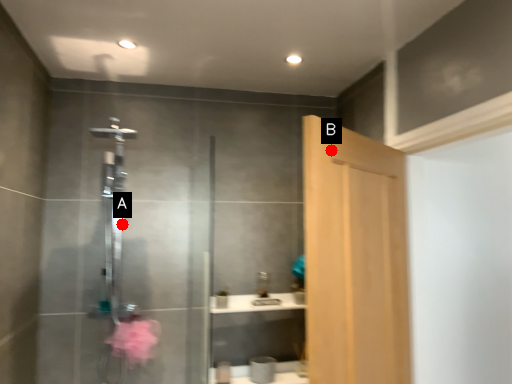
Question: Two points are circled on the image, labeled by A and B beside each circle. Among these points, which one is farthest from the camera?

Choices:
 (A) A is further
 (B) B is further

Answer: (A)